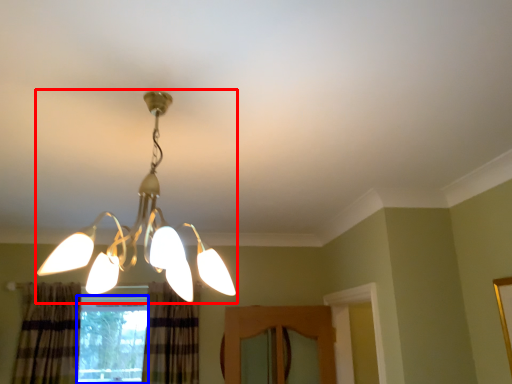
Question: Which object appears farthest to the camera in this image, lamp (highlighted by a red box) or window (highlighted by a blue box)?

Choices:
 (A) lamp
 (B) window

Answer: (B)